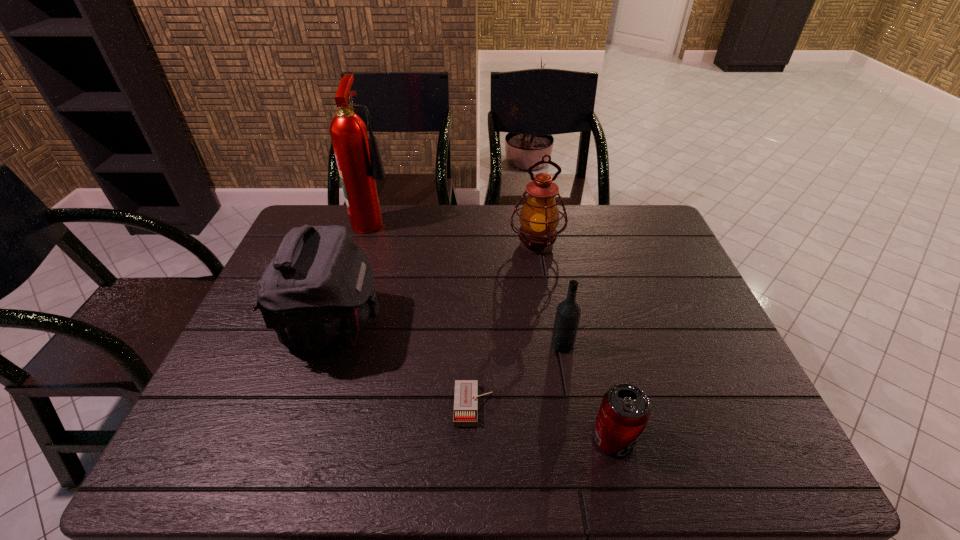
I want to click on vacant space located 0.230m on the left of the vodka, so click(x=462, y=345).

Where is `free region located on the back of the second shortest object`? This screenshot has width=960, height=540. free region located on the back of the second shortest object is located at coordinates (590, 339).

Where is `free space located on the striking surface of the shortest object`? This screenshot has width=960, height=540. free space located on the striking surface of the shortest object is located at coordinates (630, 406).

This screenshot has width=960, height=540. In order to click on fire extinguisher at the far edge in this screenshot , I will do `click(359, 163)`.

You are a GUI agent. You are given a task and a screenshot of the screen. Output one action in this format:
    pyautogui.click(x=<x>, y=<y>)
    Task: Click on the oil lamp that is positioned at the far edge
    
    Given the screenshot: What is the action you would take?
    click(x=539, y=217)

Where is `object at the near edge`? Image resolution: width=960 pixels, height=540 pixels. object at the near edge is located at coordinates (625, 409).

Locate an element on the screen. The height and width of the screenshot is (540, 960). object that is at the left edge is located at coordinates (316, 293).

You are a GUI agent. You are given a task and a screenshot of the screen. Output one action in this format:
    pyautogui.click(x=<x>, y=<y>)
    Task: Click on the free spot at the far edge of the desktop
    
    Given the screenshot: What is the action you would take?
    pyautogui.click(x=405, y=220)

You are a GUI agent. You are given a task and a screenshot of the screen. Output one action in this format:
    pyautogui.click(x=<x>, y=<y>)
    Task: Click on the free region at the near edge of the desktop
    The width and height of the screenshot is (960, 540).
    Given the screenshot: What is the action you would take?
    pyautogui.click(x=575, y=437)

In order to click on blank space at the left edge in this screenshot , I will do `click(204, 421)`.